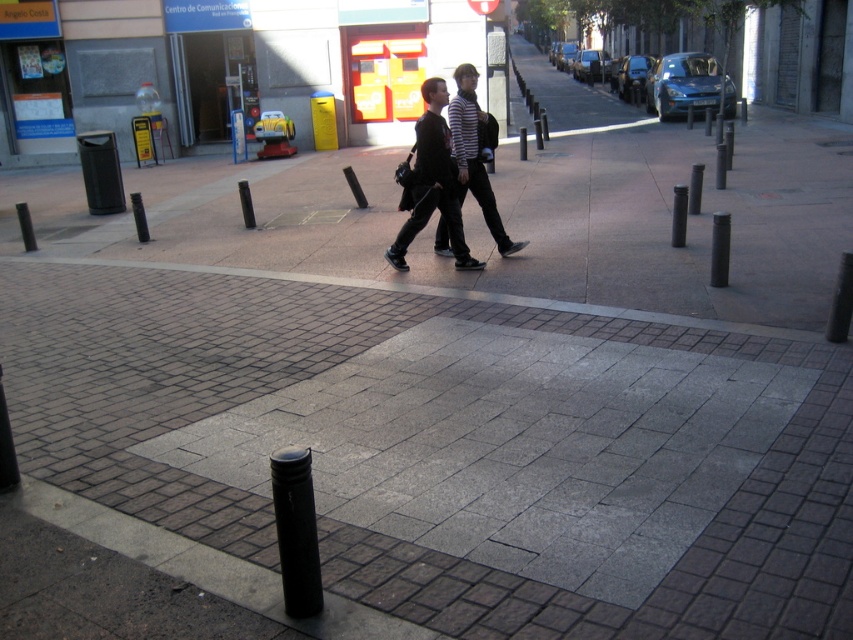
Measure the distance between smooth concrete pavement at center and black smooth pole at center.

They are 3.63 feet apart.

In the scene shown: Who is more forward, (726,570) or (309,614)?

Point (309,614) is more forward.

I want to click on smooth concrete pavement at center, so click(x=383, y=515).

Who is lower down, smooth concrete pavement at center or black smooth pole at center-right?

Positioned lower is smooth concrete pavement at center.

Is smooth concrete pavement at center wider than black smooth pole at center-right?

Yes.

Does point (347, 586) come farther from viewer compared to point (712, 284)?

No, (347, 586) is in front of (712, 284).

Find the location of a particular element. Image resolution: width=853 pixels, height=640 pixels. smooth concrete pavement at center is located at coordinates (383, 515).

Which is more to the left, black smooth pole at center or black smooth pole at center-right?

Positioned to the left is black smooth pole at center.

Is black smooth pole at center to the left of black smooth pole at center-right from the viewer's perspective?

Indeed, black smooth pole at center is positioned on the left side of black smooth pole at center-right.

The width and height of the screenshot is (853, 640). I want to click on black smooth pole at center, so click(x=296, y=531).

Where is `black smooth pole at center`? The height and width of the screenshot is (640, 853). black smooth pole at center is located at coordinates (296, 531).